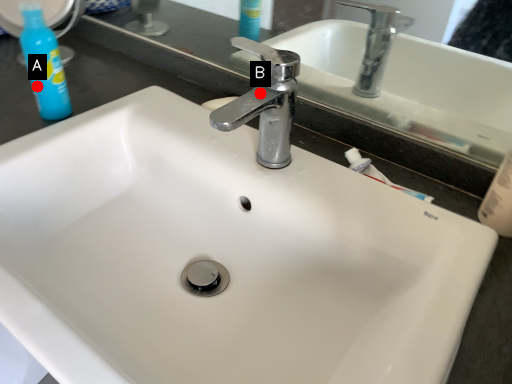
Question: Two points are circled on the image, labeled by A and B beside each circle. Among these points, which one is nearest to the camera?

Choices:
 (A) A is closer
 (B) B is closer

Answer: (B)